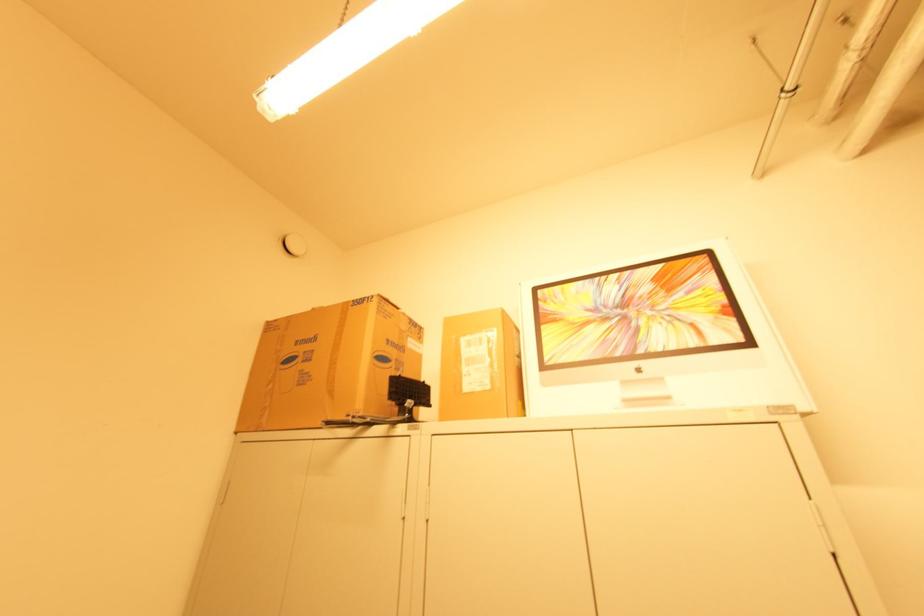
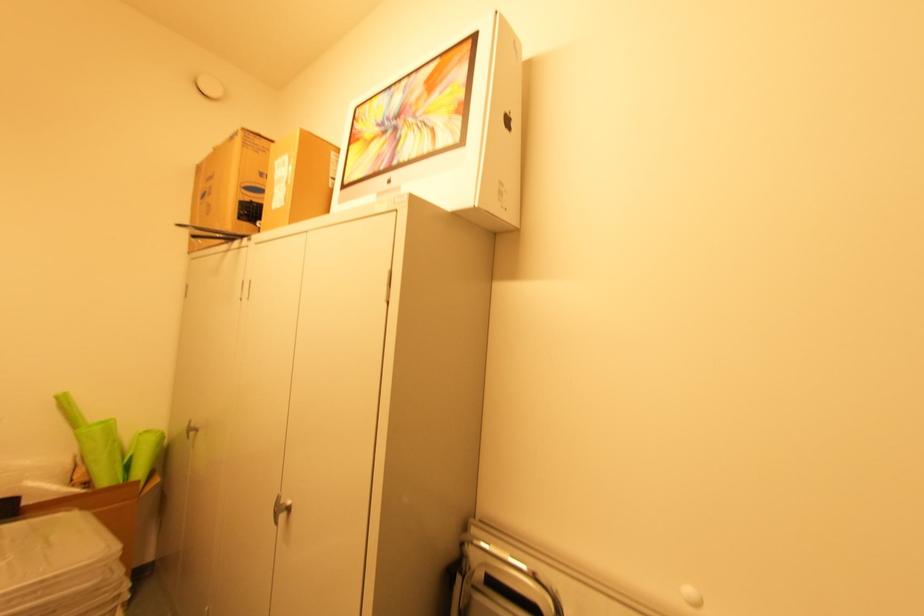
Find the pixel in the second image that matches (x=545, y=326) in the first image.

(353, 148)